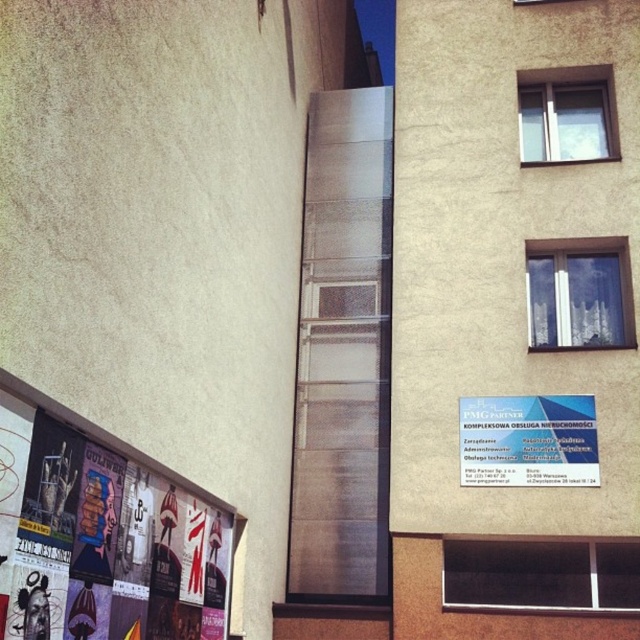
You are standing in front of the building and want to read the text on the white plastic sign at center right. However, the matte paper posters at lower left are blocking your view. Can you move the posters to get a clear view of the sign?

The matte paper posters at lower left are in front of the white plastic sign at center right, so moving them would allow you to see the sign clearly.

You are standing outside the building and want to look through the transparent glass window at center and the clear glass window at upper right. Which window will you see first when looking from your current position?

The transparent glass window at center is in front of the clear glass window at upper right, so you will see the transparent glass window at center first.